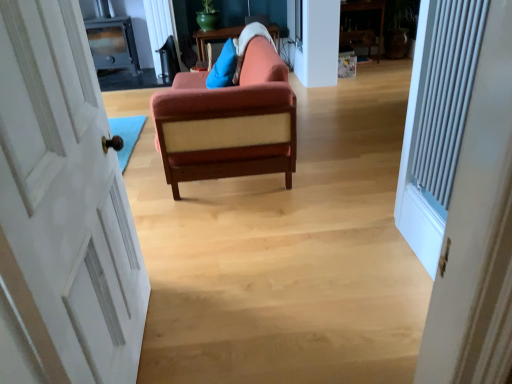
Question: Is white textured radiator at right bigger or smaller than white painted wood door at left?

Choices:
 (A) big
 (B) small

Answer: (B)

Question: Considering the positions of white textured radiator at right and white painted wood door at left in the image, is white textured radiator at right taller or shorter than white painted wood door at left?

Choices:
 (A) tall
 (B) short

Answer: (B)

Question: Which of these objects is positioned farthest from the blue fabric pillow at upper center?

Choices:
 (A) velvet orange couch at center
 (B) white painted wood door at left
 (C) metallic wood stove at upper left
 (D) teal ceramic pot at upper center
 (E) white textured radiator at right

Answer: (C)

Question: Estimate the real-world distances between objects in this image. Which object is closer to the teal ceramic pot at upper center?

Choices:
 (A) blue fabric pillow at upper center
 (B) velvet orange couch at center
 (C) metallic wood stove at upper left
 (D) white textured radiator at right
 (E) white painted wood door at left

Answer: (C)